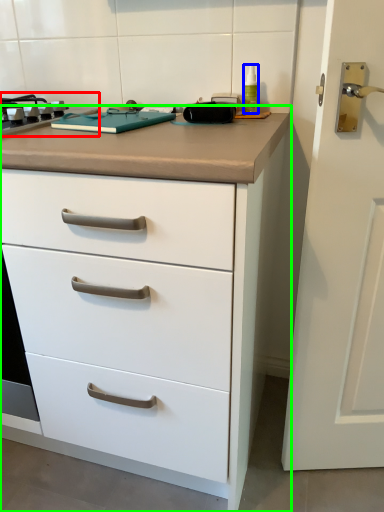
Question: Based on their relative distances, which object is farther from gas stove (highlighted by a red box)? Choose from bottle (highlighted by a blue box) and chest of drawers (highlighted by a green box).

Choices:
 (A) bottle
 (B) chest of drawers

Answer: (A)